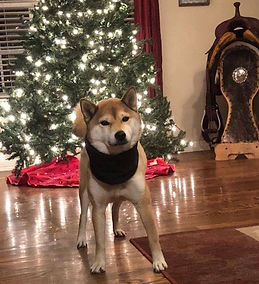
Locate an element on the screen. This screenshot has height=284, width=259. tree skirt is located at coordinates (66, 169).